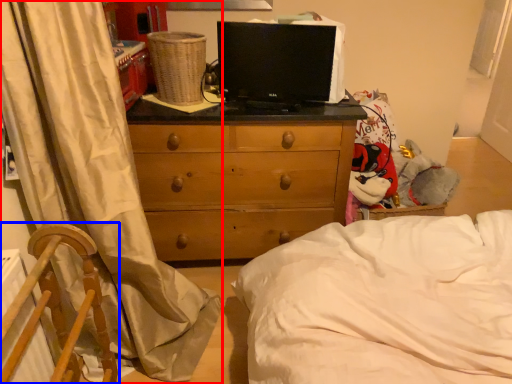
Question: Which point is further to the camera, curtain (highlighted by a red box) or furniture (highlighted by a blue box)?

Choices:
 (A) curtain
 (B) furniture

Answer: (A)